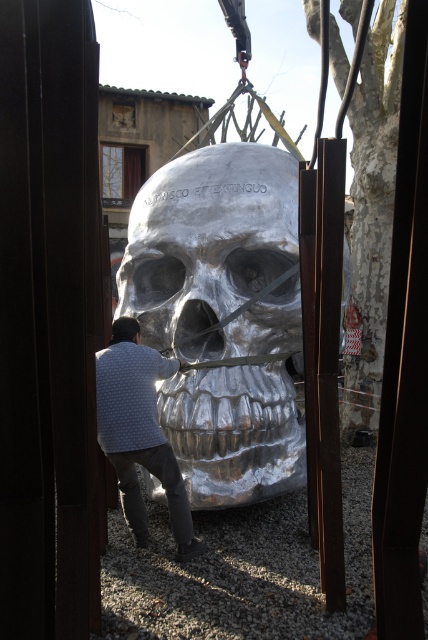
You are an art installer working on positioning the shiny silver skull at center and the white dotted sweater at center. Based on the scene, which object is wider?

The shiny silver skull at center is wider than the white dotted sweater at center according to the description.

You are an art installer working on positioning the shiny silver skull at center and the white dotted sweater at center. From your perspective, which object is closer to the right side of the image?

The shiny silver skull at center is to the right of the white dotted sweater at center, so the shiny silver skull at center is closer to the right side of the image.